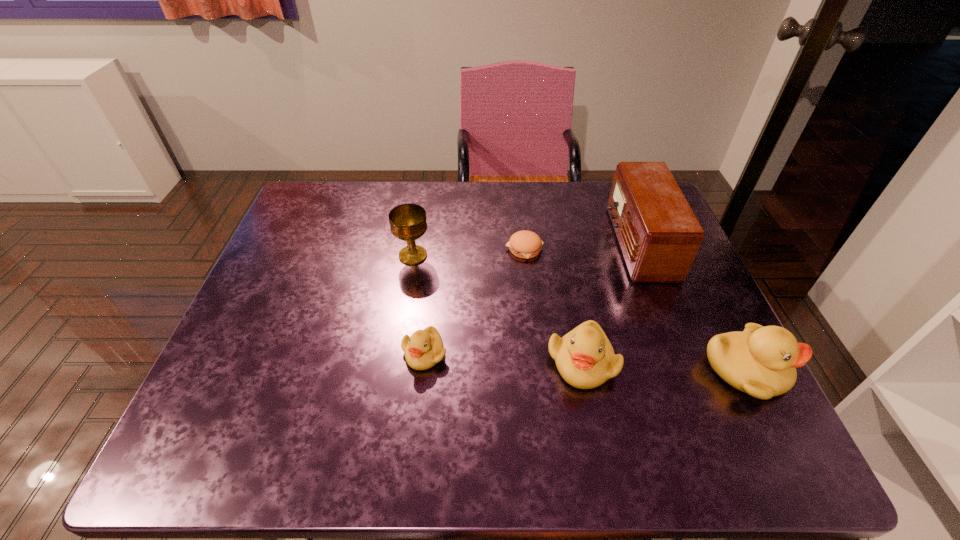
Identify the location of free spot between the second duckling from left to right and the patty. (553, 305).

Locate an element on the screen. The height and width of the screenshot is (540, 960). unoccupied position between the shortest object and the chalice is located at coordinates (468, 252).

Locate which object is the closest to the radio receiver. Please provide its 2D coordinates. Your answer should be formatted as a tuple, i.e. [(x, y)], where the tuple contains the x and y coordinates of a point satisfying the conditions above.

[(761, 361)]

The height and width of the screenshot is (540, 960). In order to click on object that stands as the fourth closest to the second shortest duckling in this screenshot , I will do `click(524, 244)`.

The height and width of the screenshot is (540, 960). I want to click on duckling that is the third closest to the radio receiver, so click(x=423, y=349).

Locate an element on the screen. The height and width of the screenshot is (540, 960). duckling that is the second nearest to the rightmost duckling is located at coordinates (423, 349).

Where is `vacant area in the image that satisfies the following two spatial constraints: 1. on the front-facing side of the tallest object; 2. on the front-facing side of the third shortest object`? This screenshot has width=960, height=540. vacant area in the image that satisfies the following two spatial constraints: 1. on the front-facing side of the tallest object; 2. on the front-facing side of the third shortest object is located at coordinates (684, 361).

Image resolution: width=960 pixels, height=540 pixels. I want to click on free space in the image that satisfies the following two spatial constraints: 1. on the front-facing side of the tallest object; 2. on the front-facing side of the second shortest duckling, so click(x=684, y=361).